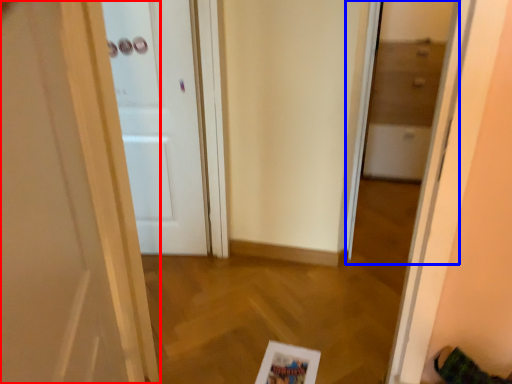
Question: Which point is further to the camera, door (highlighted by a red box) or glass door (highlighted by a blue box)?

Choices:
 (A) door
 (B) glass door

Answer: (B)